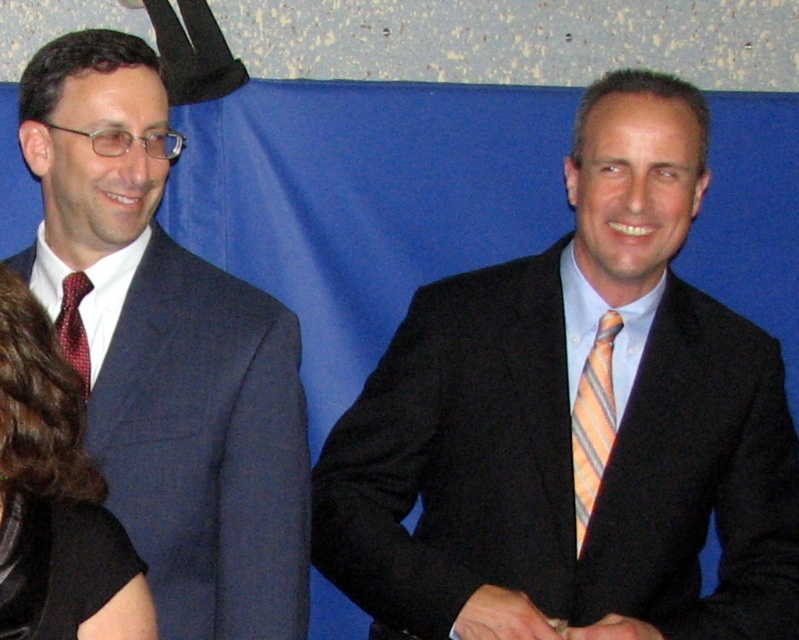
You are a photographer setting up for a formal event. You need to adjust the lighting so that both the matte black suit at left and the orange striped tie at right are well illuminated. Considering their sizes, which object requires a wider light spread to ensure proper exposure?

The matte black suit at left requires a wider light spread because it has a greater height than the orange striped tie at right, meaning it covers more area and needs more even lighting to ensure proper exposure.

In the scene shown: You are a photographer adjusting the focus of your camera. You have two points in the image, point (50,381) and point (82,380). Which point should you focus on to ensure the subject closest to the camera is sharp?

Point (50,381) is closer to the camera than point (82,380), so you should focus on point (50,381) to ensure the subject closest to the camera is sharp.

Based on the scene description, where is the matte black suit at center located in terms of its 2D coordinates?

The matte black suit at center is located at the 2D coordinates of point (570, 424).